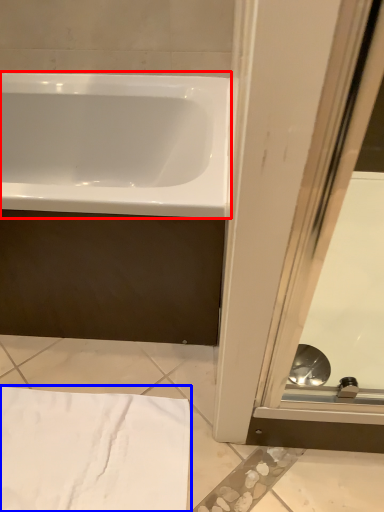
Question: Which object is further to the camera taking this photo, bathtub (highlighted by a red box) or bath towel (highlighted by a blue box)?

Choices:
 (A) bathtub
 (B) bath towel

Answer: (B)